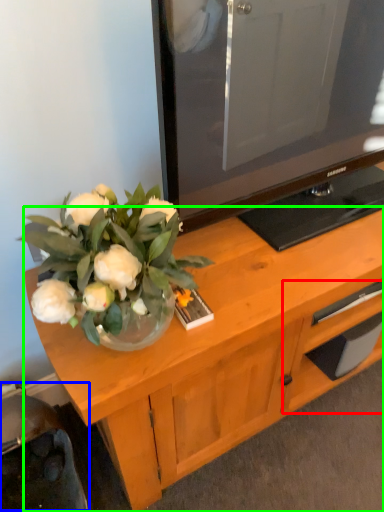
Question: Based on their relative distances, which object is nearer to drawer (highlighted by a red box)? Choose from swivel chair (highlighted by a blue box) and desk (highlighted by a green box).

Choices:
 (A) swivel chair
 (B) desk

Answer: (B)